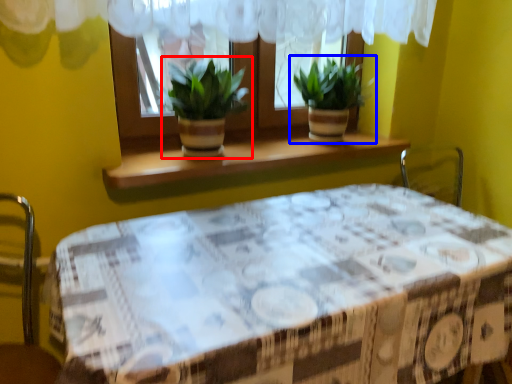
Question: Which object appears farthest to the camera in this image, houseplant (highlighted by a red box) or houseplant (highlighted by a blue box)?

Choices:
 (A) houseplant
 (B) houseplant

Answer: (B)